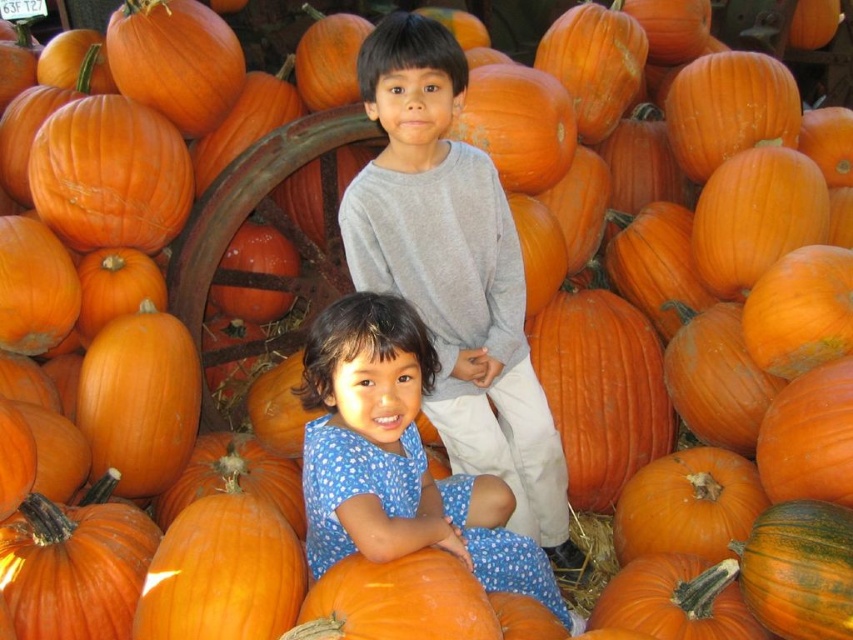
You are a photographer setting up for a group photo. You need to ensure that the gray cotton shirt at center and the blue dotted dress at center are both visible in the frame. Given their heights, which clothing item should you position closer to the front to avoid blocking the other?

The gray cotton shirt at center is taller than the blue dotted dress at center. To prevent the taller gray cotton shirt at center from blocking the shorter blue dotted dress at center, position the blue dotted dress at center closer to the front of the frame.